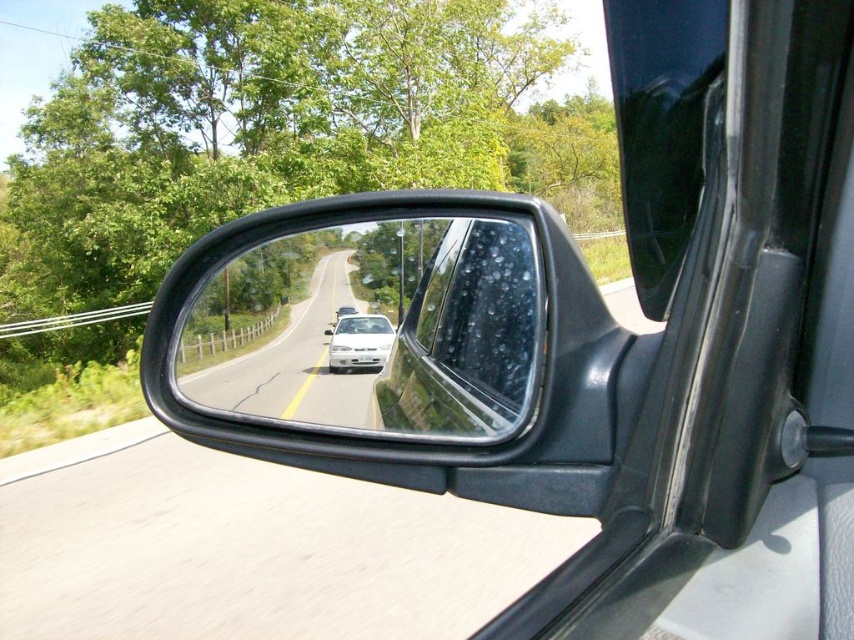
You are a driver checking your side mirror and notice both the clear plastic mirror at center and the transparent wet glass at center. Which object is taller?

The clear plastic mirror at center is taller than the transparent wet glass at center.

You are a driver checking your side mirror. You notice a point marked at coordinates (373, 328). What object does this point correspond to?

The point at coordinates (373, 328) corresponds to the clear plastic mirror at center.

You are driving a car and want to check your blind spot. You look at the clear plastic mirror at center and the white glossy car at center. Which object would allow you to see the blind spot area better?

The clear plastic mirror at center is bigger than the white glossy car at center, so the clear plastic mirror at center provides a larger reflective surface and would allow you to see the blind spot area better.